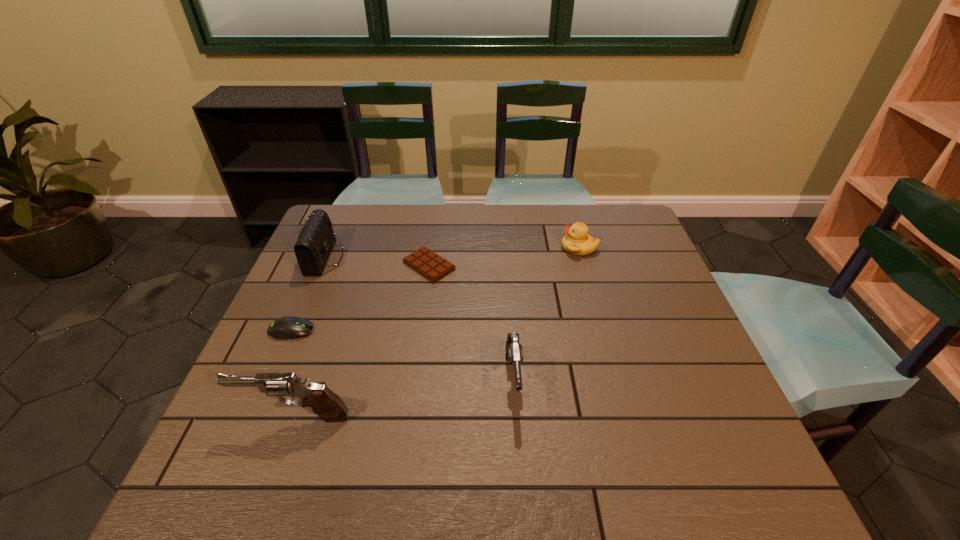
Please point a free position for a pistol on the right. Please provide its 2D coordinates. Your answer should be formatted as a tuple, i.e. [(x, y)], where the tuple contains the x and y coordinates of a point satisfying the conditions above.

[(704, 349)]